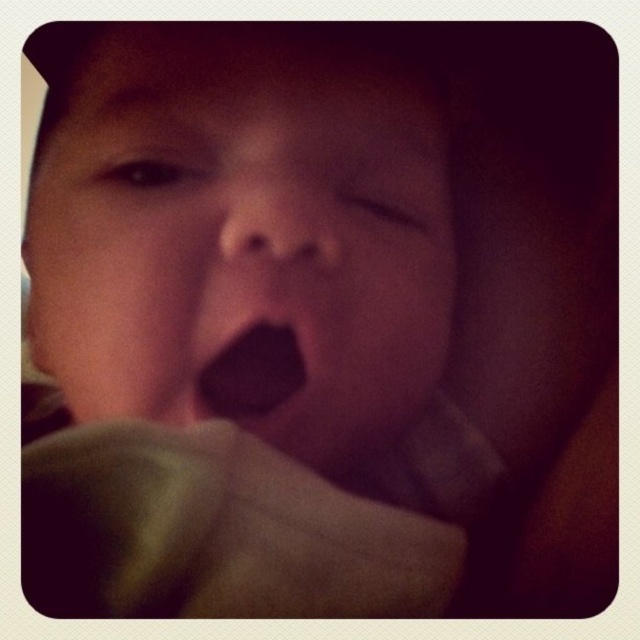
Does smooth skin face at center lie in front of black matte tongue at center?

Yes, smooth skin face at center is closer to the viewer.

Who is more distant from viewer, (109, 54) or (282, 328)?

Positioned behind is point (109, 54).

Who is more forward, (x=307, y=116) or (x=273, y=346)?

Positioned in front is point (x=273, y=346).

The height and width of the screenshot is (640, 640). Identify the location of smooth skin face at center. (x=243, y=240).